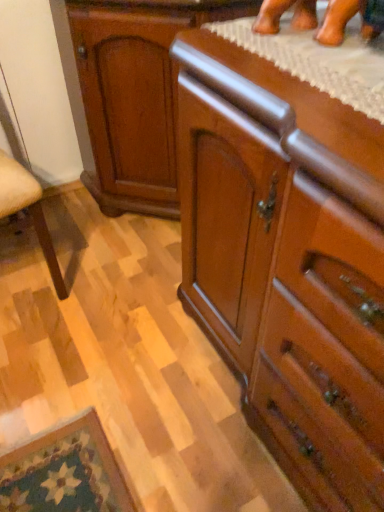
This screenshot has width=384, height=512. What do you see at coordinates (288, 261) in the screenshot?
I see `polished wood chest of drawers at center` at bounding box center [288, 261].

Find the location of a particular element. This screenshot has width=384, height=512. polished wood chest of drawers at center is located at coordinates (288, 261).

What is the approximate height of glossy wood cabinet at center?

glossy wood cabinet at center is 87.40 centimeters in height.

Describe the element at coordinates (135, 95) in the screenshot. I see `glossy wood cabinet at center` at that location.

You are a GUI agent. You are given a task and a screenshot of the screen. Output one action in this format:
    pyautogui.click(x=<x>, y=<y>)
    Task: Click on the glossy wood cabinet at center
    This screenshot has width=384, height=512.
    Given the screenshot: What is the action you would take?
    pyautogui.click(x=135, y=95)

Identify the location of polished wood chest of drawers at center. (288, 261).

Considering the relative positions of polished wood chest of drawers at center and glossy wood cabinet at center in the image provided, is polished wood chest of drawers at center to the left of glossy wood cabinet at center from the viewer's perspective?

No.

Is the position of polished wood chest of drawers at center less distant than that of glossy wood cabinet at center?

Yes.

Between point (365, 381) and point (147, 33), which one is positioned behind?

Positioned behind is point (147, 33).

From the image's perspective, which is below, polished wood chest of drawers at center or glossy wood cabinet at center?

polished wood chest of drawers at center, from the image's perspective.

From a real-world perspective, is polished wood chest of drawers at center located beneath glossy wood cabinet at center?

Yes.

Considering the relative sizes of polished wood chest of drawers at center and glossy wood cabinet at center in the image provided, is polished wood chest of drawers at center wider than glossy wood cabinet at center?

Indeed, polished wood chest of drawers at center has a greater width compared to glossy wood cabinet at center.

Is polished wood chest of drawers at center taller than glossy wood cabinet at center?

Correct, polished wood chest of drawers at center is much taller as glossy wood cabinet at center.

Based on their sizes in the image, would you say polished wood chest of drawers at center is bigger or smaller than glossy wood cabinet at center?

In the image, polished wood chest of drawers at center appears to be larger than glossy wood cabinet at center.

Is polished wood chest of drawers at center inside the boundaries of glossy wood cabinet at center, or outside?

polished wood chest of drawers at center is not inside glossy wood cabinet at center, it's outside.

Is there a large distance between polished wood chest of drawers at center and glossy wood cabinet at center?

No, polished wood chest of drawers at center is in close proximity to glossy wood cabinet at center.

Is polished wood chest of drawers at center positioned with its back to glossy wood cabinet at center?

That's not correct — polished wood chest of drawers at center is not looking away from glossy wood cabinet at center.

What's the angular difference between polished wood chest of drawers at center and glossy wood cabinet at center's facing directions?

42.5 degrees.

The image size is (384, 512). I want to click on the chest of drawers beneath the glossy wood cabinet at center (from a real-world perspective), so click(x=288, y=261).

Considering the relative positions of glossy wood cabinet at center and polished wood chest of drawers at center in the image provided, is glossy wood cabinet at center to the left of polished wood chest of drawers at center from the viewer's perspective?

Correct, you'll find glossy wood cabinet at center to the left of polished wood chest of drawers at center.

Considering the positions of objects glossy wood cabinet at center and polished wood chest of drawers at center in the image provided, who is in front, glossy wood cabinet at center or polished wood chest of drawers at center?

polished wood chest of drawers at center is in front.

Considering the positions of point (97, 52) and point (248, 386), is point (97, 52) closer or farther from the camera than point (248, 386)?

Point (97, 52).

From the image's perspective, who appears lower, glossy wood cabinet at center or polished wood chest of drawers at center?

polished wood chest of drawers at center appears lower in the image.

From a real-world perspective, is glossy wood cabinet at center positioned above or below polished wood chest of drawers at center?

Clearly, from a real-world perspective, glossy wood cabinet at center is above polished wood chest of drawers at center.

In the scene shown: Considering the sizes of objects glossy wood cabinet at center and polished wood chest of drawers at center in the image provided, who is wider, glossy wood cabinet at center or polished wood chest of drawers at center?

polished wood chest of drawers at center.

Is glossy wood cabinet at center shorter than polished wood chest of drawers at center?

Yes, glossy wood cabinet at center is shorter than polished wood chest of drawers at center.

Does glossy wood cabinet at center have a smaller size compared to polished wood chest of drawers at center?

Yes, glossy wood cabinet at center is smaller than polished wood chest of drawers at center.

Is polished wood chest of drawers at center inside glossy wood cabinet at center?

No, glossy wood cabinet at center does not contain polished wood chest of drawers at center.

Are glossy wood cabinet at center and polished wood chest of drawers at center beside each other?

No, glossy wood cabinet at center is not in contact with polished wood chest of drawers at center.

Is polished wood chest of drawers at center at the back of glossy wood cabinet at center?

No, glossy wood cabinet at center's orientation is not away from polished wood chest of drawers at center.

Can you tell me how much glossy wood cabinet at center and polished wood chest of drawers at center differ in facing direction?

42.5 degrees separate the facing orientations of glossy wood cabinet at center and polished wood chest of drawers at center.

From the picture: How much distance is there between glossy wood cabinet at center and polished wood chest of drawers at center?

glossy wood cabinet at center and polished wood chest of drawers at center are 21.97 inches apart from each other.

Locate an element on the screen. The width and height of the screenshot is (384, 512). cabinetry that appears above the polished wood chest of drawers at center (from a real-world perspective) is located at coordinates [135, 95].

The height and width of the screenshot is (512, 384). I want to click on chest of drawers in front of the glossy wood cabinet at center, so click(x=288, y=261).

This screenshot has height=512, width=384. I want to click on cabinetry above the polished wood chest of drawers at center (from the image's perspective), so click(x=135, y=95).